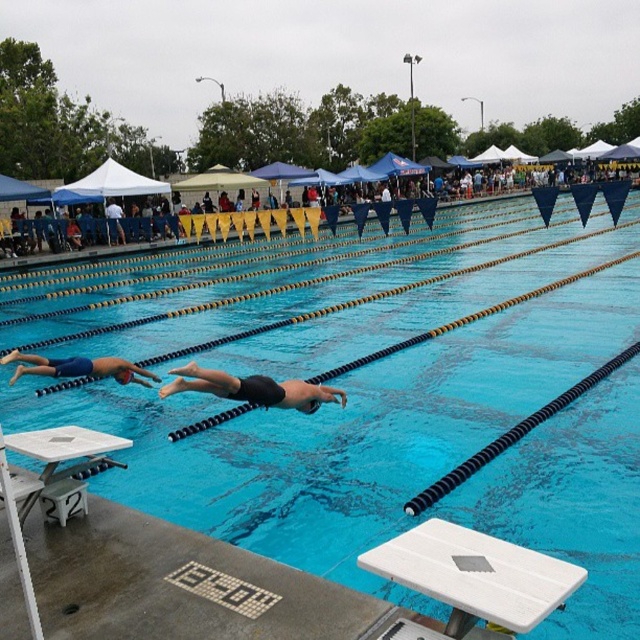
Question: Is smooth black swimmer at center bigger than black matte swimmer at center?

Choices:
 (A) yes
 (B) no

Answer: (A)

Question: Is black matte swimmer at center thinner than blue matte swimmer at left?

Choices:
 (A) no
 (B) yes

Answer: (B)

Question: Is blue rubber lane dividers at center to the right of white plastic diving board at lower center from the viewer's perspective?

Choices:
 (A) yes
 (B) no

Answer: (A)

Question: Which object is the farthest from the blue rubber lane dividers at center?

Choices:
 (A) blue matte swimmer at left
 (B) smooth black swimmer at center

Answer: (B)

Question: Which object is the farthest from the white plastic diving board at lower center?

Choices:
 (A) blue matte swimmer at left
 (B) smooth black swimmer at center
 (C) black matte swimmer at center

Answer: (B)

Question: Which of the following is the closest to the observer?

Choices:
 (A) white plastic diving board at lower center
 (B) blue rubber lane dividers at center
 (C) blue matte swimmer at left

Answer: (A)